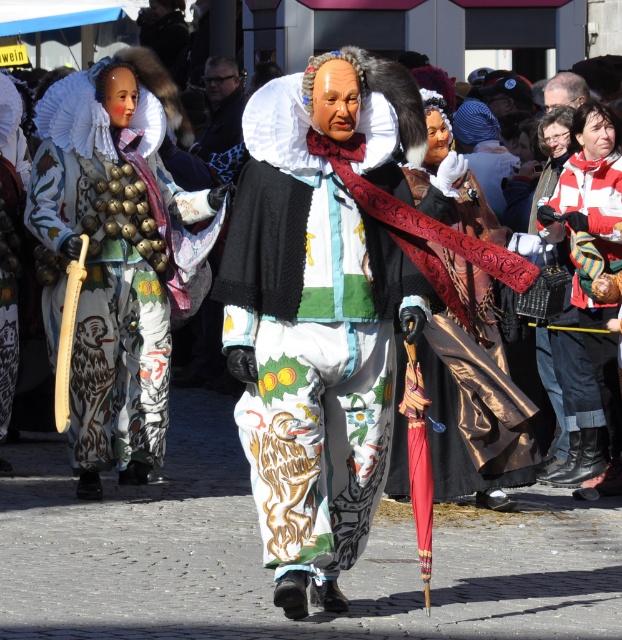
You are a photographer standing in the crowd at this event. You want to take a photo that includes both the striped wool scarf at right and the smooth bald head at center. Which object should you position closer to the top of the frame to ensure both are fully visible?

The striped wool scarf at right is taller than the smooth bald head at center, so you should position the striped wool scarf at right closer to the top of the frame to ensure both are fully visible.

You are a photographer trying to capture a closeup of the smooth bald head at center without including the striped wool scarf at right in the frame. Given their relative sizes, is this feasible?

The striped wool scarf at right is wider than the smooth bald head at center, so it might be challenging to frame the head without including the scarf if they are positioned closely together. Adjusting the camera angle or zoom could help isolate the head.